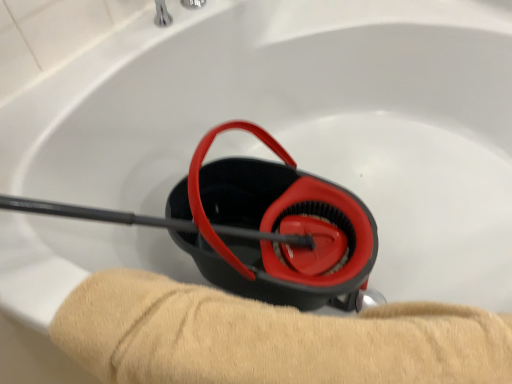
Question: Relative to silver metallic faucet at upper center, is soft beige towel at lower center in front or behind?

Choices:
 (A) front
 (B) behind

Answer: (A)

Question: Does point (362, 345) appear closer or farther from the camera than point (199, 1)?

Choices:
 (A) closer
 (B) farther

Answer: (A)

Question: Considering the relative positions of soft beige towel at lower center and silver metallic faucet at upper center in the image provided, is soft beige towel at lower center to the left or to the right of silver metallic faucet at upper center?

Choices:
 (A) left
 (B) right

Answer: (B)

Question: Would you say silver metallic faucet at upper center is to the left or to the right of soft beige towel at lower center in the picture?

Choices:
 (A) left
 (B) right

Answer: (A)

Question: Considering the positions of point (181, 1) and point (289, 357), is point (181, 1) closer or farther from the camera than point (289, 357)?

Choices:
 (A) closer
 (B) farther

Answer: (B)

Question: Based on their sizes in the image, would you say silver metallic faucet at upper center is bigger or smaller than soft beige towel at lower center?

Choices:
 (A) small
 (B) big

Answer: (A)

Question: Is silver metallic faucet at upper center situated inside soft beige towel at lower center or outside?

Choices:
 (A) outside
 (B) inside

Answer: (A)